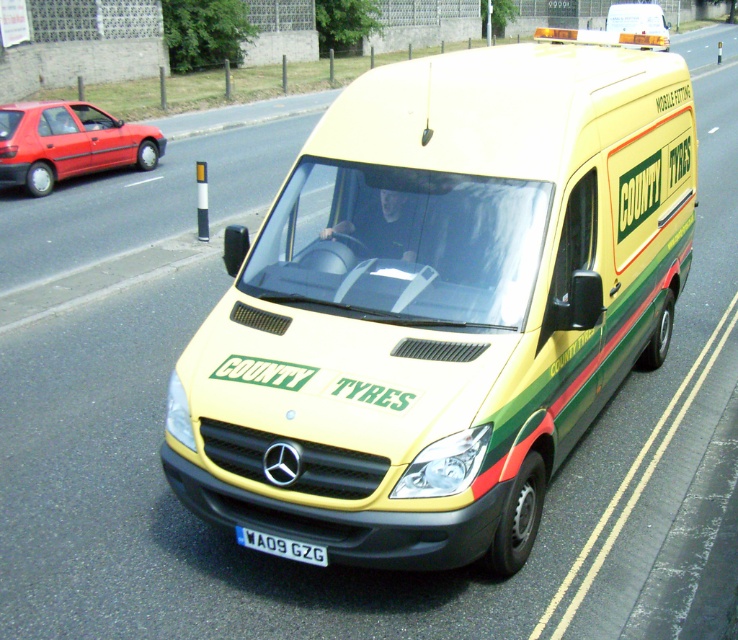
Question: Does yellow matte van at center come behind matte red car at left?

Choices:
 (A) yes
 (B) no

Answer: (B)

Question: Considering the real-world distances, which object is closest to the yellow matte van at upper center?

Choices:
 (A) white plastic license plate at center
 (B) matte red car at left

Answer: (A)

Question: Which object is the closest to the yellow matte van at center?

Choices:
 (A) white plastic license plate at center
 (B) yellow matte van at upper center

Answer: (A)

Question: Is matte red car at left positioned at the back of white plastic license plate at center?

Choices:
 (A) yes
 (B) no

Answer: (A)

Question: Which of the following is the farthest from the observer?

Choices:
 (A) (658, 17)
 (B) (120, 156)

Answer: (A)

Question: Does yellow matte van at center appear over white plastic license plate at center?

Choices:
 (A) yes
 (B) no

Answer: (A)